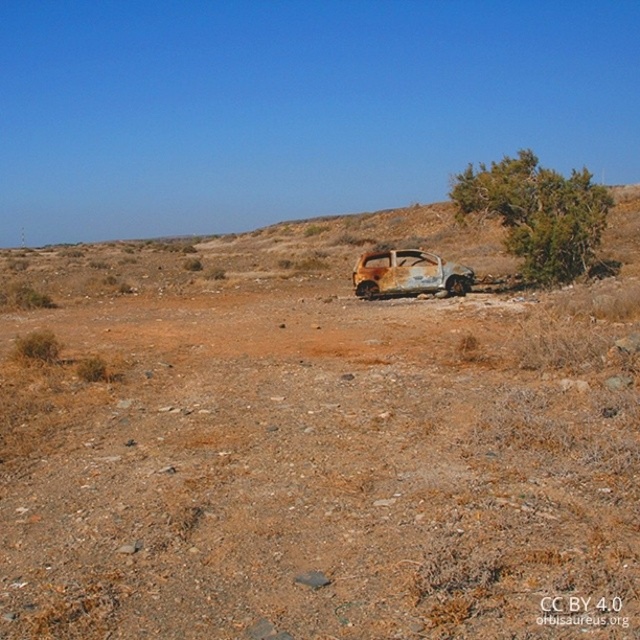
Question: Is the position of green leafy bush at center less distant than that of rusty metal car at center?

Choices:
 (A) no
 (B) yes

Answer: (B)

Question: Which object is closer to the camera taking this photo?

Choices:
 (A) rusty metal car at center
 (B) green leafy bush at center

Answer: (B)

Question: Can you confirm if green leafy bush at center is bigger than rusty metal car at center?

Choices:
 (A) yes
 (B) no

Answer: (A)

Question: Is green leafy bush at center smaller than rusty metal car at center?

Choices:
 (A) yes
 (B) no

Answer: (B)

Question: Which point is closer to the camera?

Choices:
 (A) green leafy bush at center
 (B) rusty metal car at center

Answer: (A)